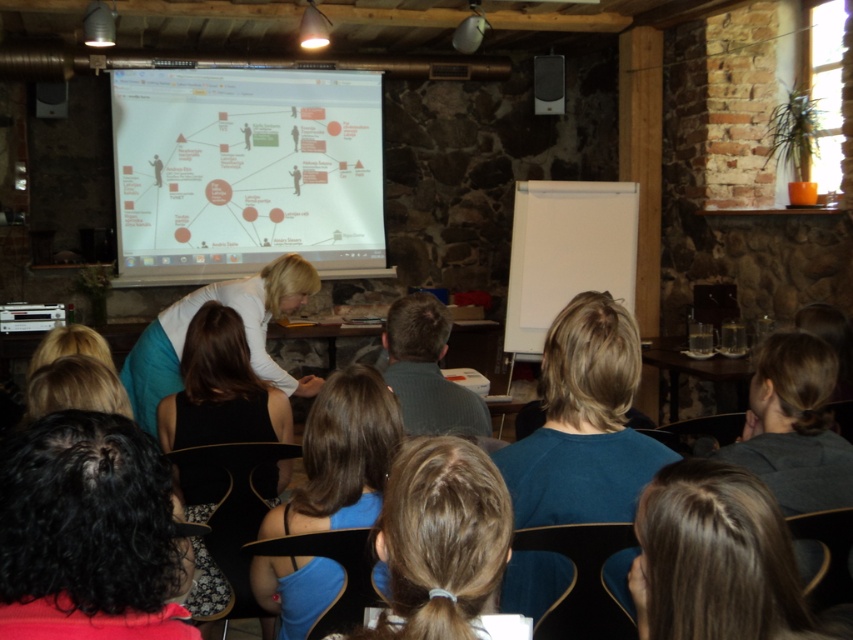
Which is behind, point (316, 148) or point (788, 588)?

Point (316, 148)

Does white glossy projector screen at upper center have a larger size compared to brown hair at lower center?

Yes, white glossy projector screen at upper center is bigger than brown hair at lower center.

Does point (142, 205) lie behind point (770, 496)?

Yes, point (142, 205) is behind point (770, 496).

You are a GUI agent. You are given a task and a screenshot of the screen. Output one action in this format:
    pyautogui.click(x=<x>, y=<y>)
    Task: Click on the white glossy projector screen at upper center
    The height and width of the screenshot is (640, 853).
    Given the screenshot: What is the action you would take?
    pyautogui.click(x=245, y=170)

Can you confirm if white glossy projector screen at upper center is wider than blue fabric hair at center?

Yes.

Is point (134, 96) positioned before point (282, 596)?

That is False.

This screenshot has height=640, width=853. Identify the location of white glossy projector screen at upper center. (245, 170).

Between brown hair at lower center and black fabric dress at center, which one appears on the left side from the viewer's perspective?

Positioned to the left is black fabric dress at center.

Is brown hair at lower center below black fabric dress at center?

Incorrect, brown hair at lower center is not positioned below black fabric dress at center.

Does point (787, 541) come behind point (248, 385)?

No.

Locate an element on the screen. The width and height of the screenshot is (853, 640). brown hair at lower center is located at coordinates (718, 561).